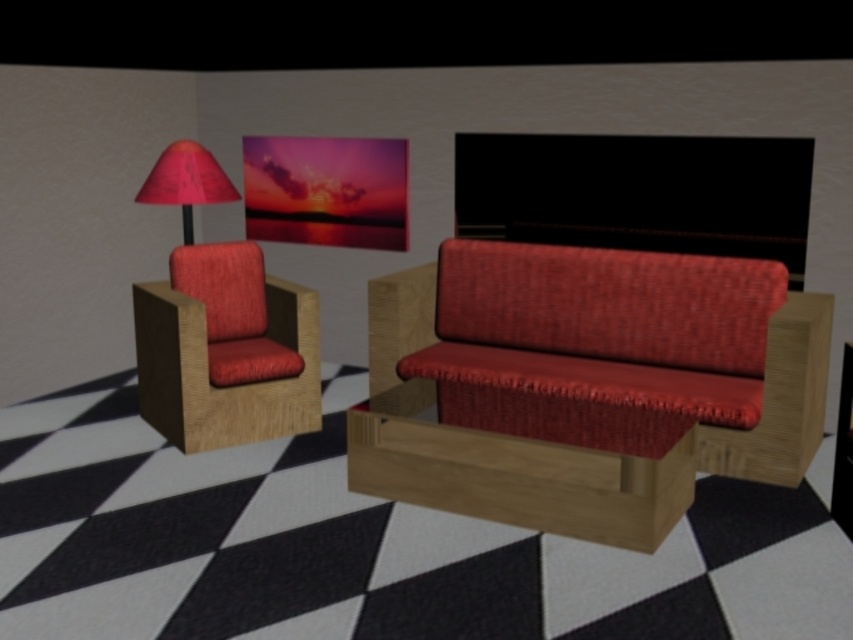
In the scene shown: You are standing in the room and want to place a new plant pot between the matte red fabric couch at center and the matte red lampshade at upper left. Based on their positions, which object should the plant pot be closer to?

The matte red fabric couch at center is located below the matte red lampshade at upper left, so the plant pot should be placed closer to the matte red fabric couch at center since it is lower in position.

You are a delivery person who needs to place a package on the floor between the matte wood armchair at left and the matte red lampshade at upper left. Can you tell me which object you should move to make space?

The matte wood armchair at left is taller than the matte red lampshade at upper left, so you should move the matte wood armchair at left to make space.

You are standing in the room and want to walk from point A to point B. Point A is at coordinate point A which is point at (x=538, y=298) and point B is at coordinate point B which is point at (x=144, y=323). Since you are facing the room, which direction should you turn to move from point A to point B?

Point A at (x=538, y=298) is further to the viewer than point B at (x=144, y=323). To move from point A to point B, you should turn towards the direction that leads you away from the viewer, which would be towards the lower part of the room.